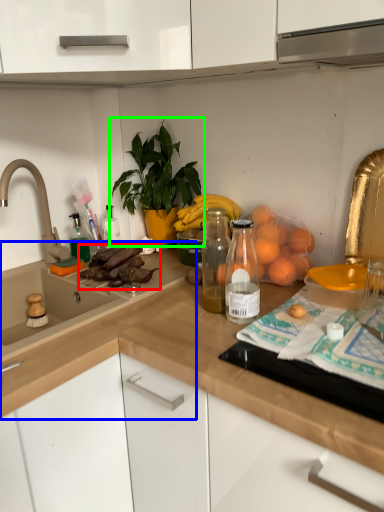
Question: Which object is positioned farthest from food (highlighted by a red box)? Select from countertop (highlighted by a blue box) and houseplant (highlighted by a green box).

Choices:
 (A) countertop
 (B) houseplant

Answer: (B)